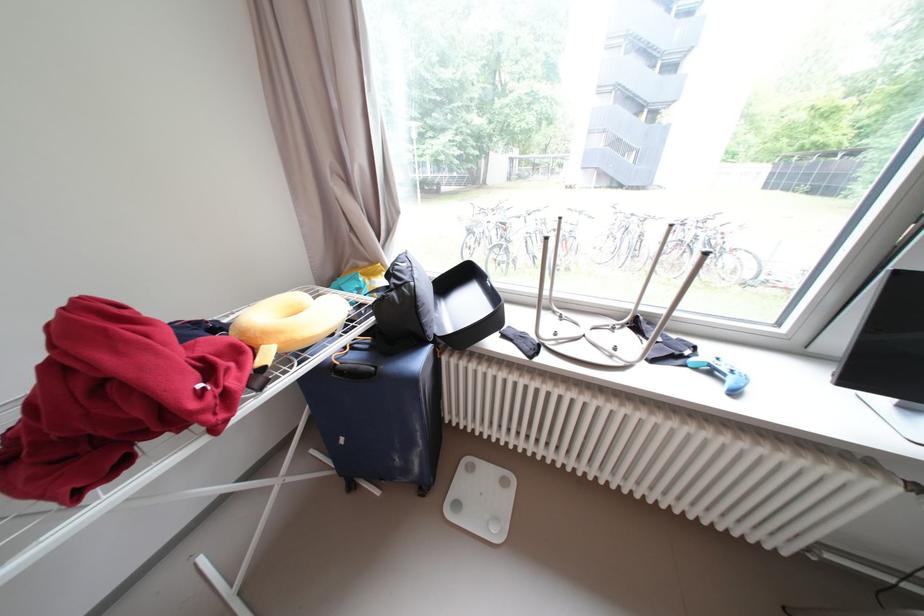
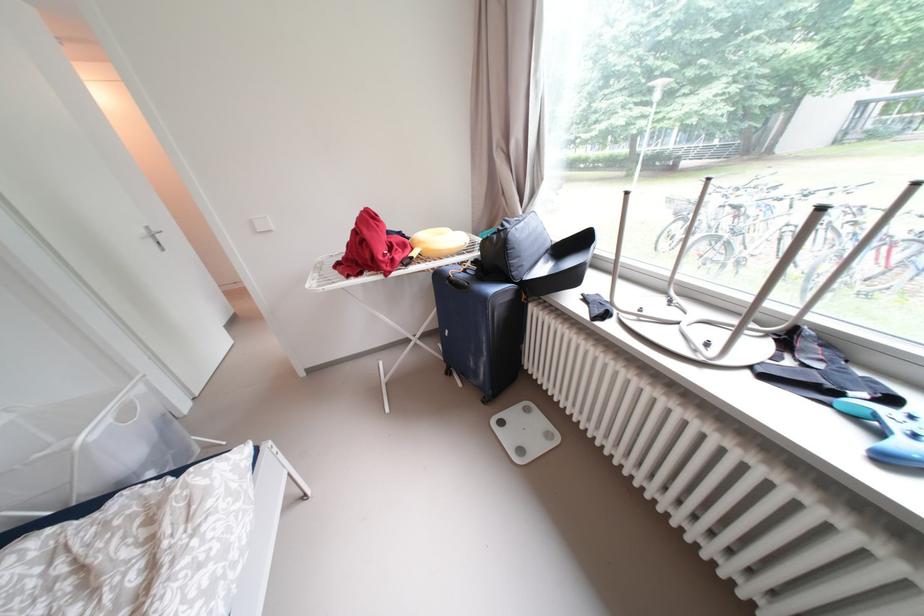
Question: The images are taken continuously from a first-person perspective. In which direction is your viewpoint rotating?

Choices:
 (A) Left
 (B) Right
 (C) Up
 (D) Down

Answer: (A)